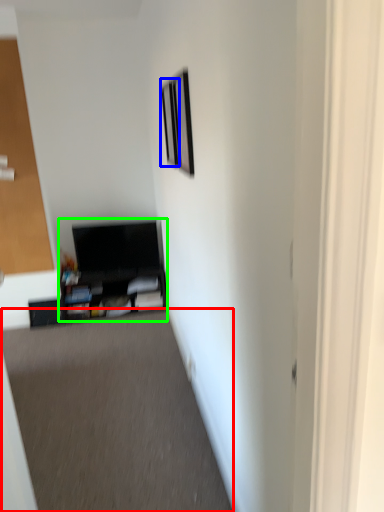
Question: Estimate the real-world distances between objects in this image. Which object is farther from plain (highlighted by a red box), picture frame (highlighted by a blue box) or entertainment center (highlighted by a green box)?

Choices:
 (A) picture frame
 (B) entertainment center

Answer: (A)